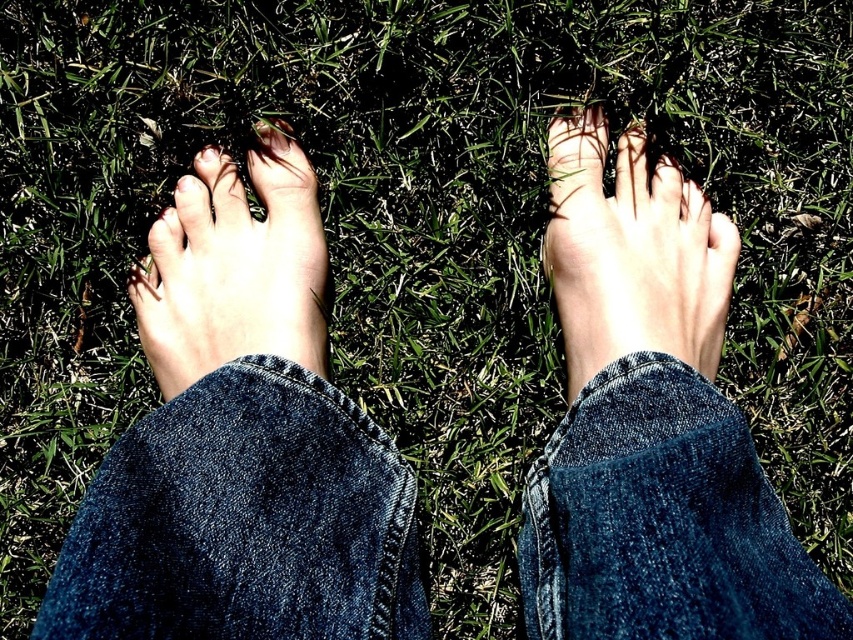
Question: Which of the following is the closest to the observer?

Choices:
 (A) (134, 630)
 (B) (732, 276)
 (C) (149, 336)

Answer: (A)

Question: Does denim at center appear on the right side of pale skin foot at center?

Choices:
 (A) no
 (B) yes

Answer: (A)

Question: Can you confirm if denim at center is positioned to the left of pale skin foot at center?

Choices:
 (A) no
 (B) yes

Answer: (B)

Question: Which point is farther to the camera?

Choices:
 (A) denim at center
 (B) natural skin tone foot at left

Answer: (B)

Question: Which of these objects is positioned farthest from the pale skin foot at center?

Choices:
 (A) natural skin tone foot at left
 (B) denim at center

Answer: (A)

Question: Does denim at center come behind natural skin tone foot at left?

Choices:
 (A) no
 (B) yes

Answer: (A)